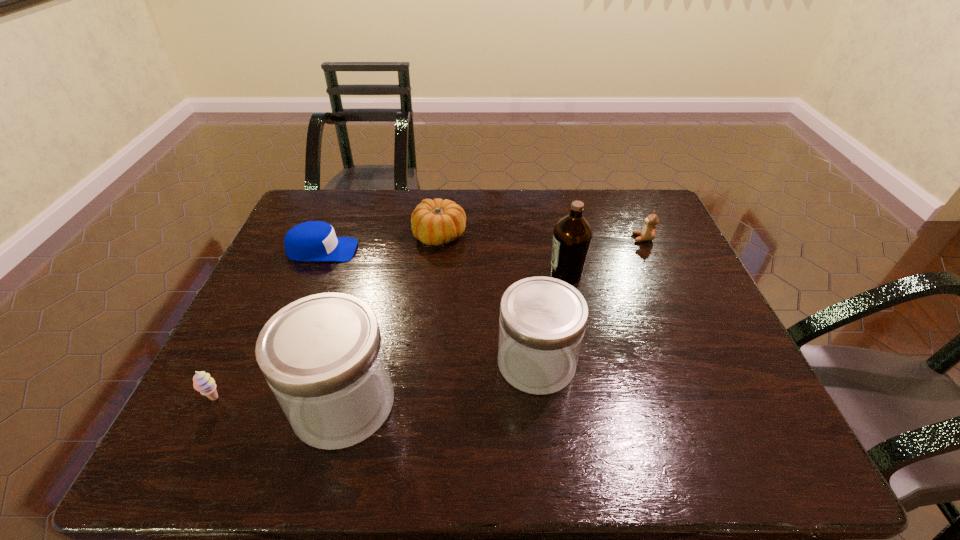
Where is `free space between the baseball cap and the rightmost object`? free space between the baseball cap and the rightmost object is located at coordinates (483, 244).

The image size is (960, 540). I want to click on free space between the left jar and the olive oil, so click(x=455, y=339).

Locate which object is the sixth closest to the taller jar. Please provide its 2D coordinates. Your answer should be formatted as a tuple, i.e. [(x, y)], where the tuple contains the x and y coordinates of a point satisfying the conditions above.

[(648, 232)]

Identify which object is located as the third nearest to the olive oil. Please provide its 2D coordinates. Your answer should be formatted as a tuple, i.e. [(x, y)], where the tuple contains the x and y coordinates of a point satisfying the conditions above.

[(436, 222)]

This screenshot has width=960, height=540. Identify the location of free spot that satisfies the following two spatial constraints: 1. on the front-facing side of the baseball cap; 2. on the back side of the taller jar. (259, 403).

Where is `free spot that satisfies the following two spatial constraints: 1. on the front-facing side of the baseball cap; 2. on the back side of the right jar`? This screenshot has height=540, width=960. free spot that satisfies the following two spatial constraints: 1. on the front-facing side of the baseball cap; 2. on the back side of the right jar is located at coordinates (276, 362).

Identify the location of vacant space that satisfies the following two spatial constraints: 1. on the front-facing side of the baseball cap; 2. on the right side of the right jar. Image resolution: width=960 pixels, height=540 pixels. (276, 362).